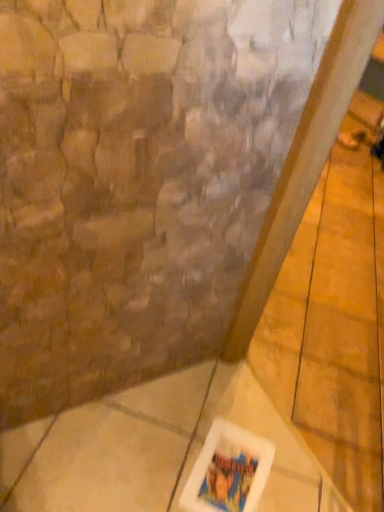
This screenshot has height=512, width=384. Identify the location of white plastic container at lower center. (228, 471).

Image resolution: width=384 pixels, height=512 pixels. What do you see at coordinates (228, 471) in the screenshot? I see `white plastic container at lower center` at bounding box center [228, 471].

The image size is (384, 512). In order to click on white plastic container at lower center in this screenshot , I will do `click(228, 471)`.